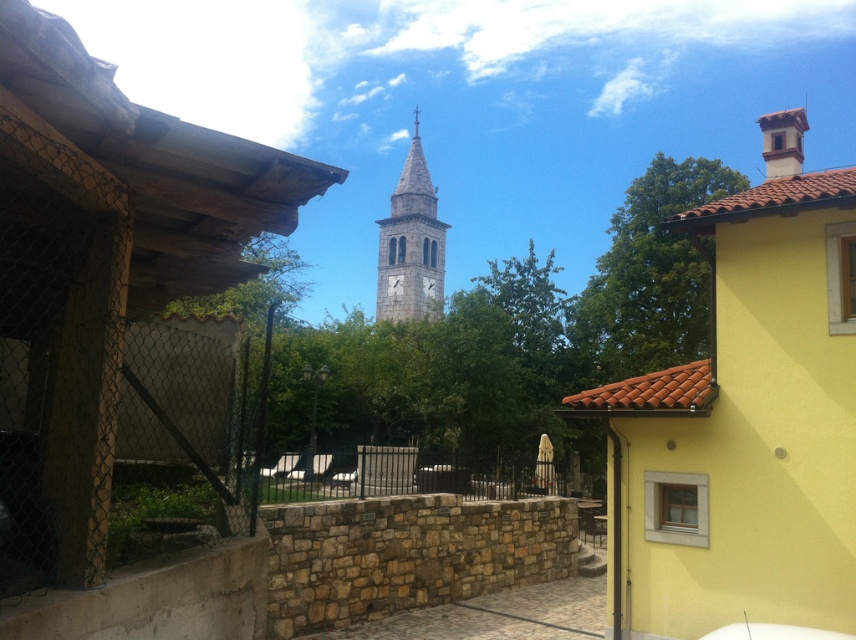
Question: Can you confirm if yellow matte building at upper right is positioned to the left of black metal fence at center?

Choices:
 (A) no
 (B) yes

Answer: (A)

Question: Is stone clock tower at center below gray stone clock tower at center?

Choices:
 (A) no
 (B) yes

Answer: (B)

Question: Can you confirm if stone clock tower at center is positioned above gray stone clock tower at center?

Choices:
 (A) yes
 (B) no

Answer: (B)

Question: Which object is the closest to the gray stone clock tower at center?

Choices:
 (A) yellow matte building at upper right
 (B) black metal fence at center

Answer: (B)

Question: Which point is closer to the camera taking this photo?

Choices:
 (A) (381, 268)
 (B) (52, 369)
 (C) (522, 468)

Answer: (B)

Question: Which of these objects is positioned farthest from the gray stone clock tower at center?

Choices:
 (A) black metal fence at center
 (B) yellow matte building at upper right
 (C) stone clock tower at center

Answer: (C)